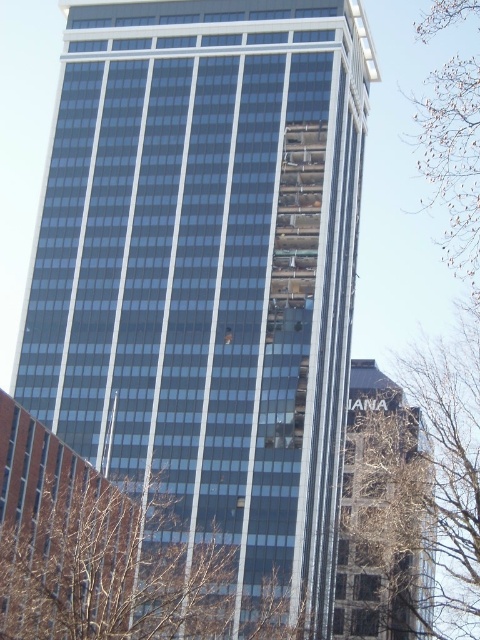
Question: Which point is farther to the camera?

Choices:
 (A) brown leafy tree at right
 (B) brown leafy tree at upper right

Answer: (B)

Question: Does brown leafy tree at right appear under brown leafless branches at lower center?

Choices:
 (A) yes
 (B) no

Answer: (A)

Question: Is brown leafy tree at right thinner than brown leafy tree at upper right?

Choices:
 (A) no
 (B) yes

Answer: (B)

Question: Which point appears farthest from the camera in this image?

Choices:
 (A) (8, 605)
 (B) (423, 477)
 (C) (478, 88)

Answer: (B)

Question: Which object is the closest to the brown leafless branches at lower center?

Choices:
 (A) brown leafy tree at upper right
 (B) brown leafy tree at right

Answer: (B)

Question: Is brown leafy tree at right to the left of brown leafless branches at lower center from the viewer's perspective?

Choices:
 (A) yes
 (B) no

Answer: (B)